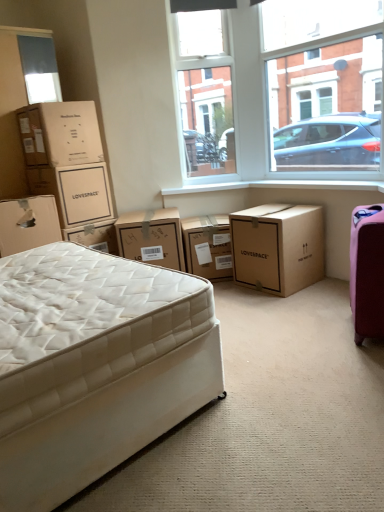
Find the location of `free point to the left of pink fabric suitcase at right`. free point to the left of pink fabric suitcase at right is located at coordinates (321, 326).